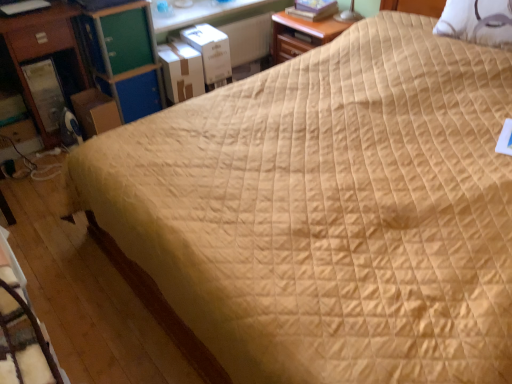
Question: Is white textured pillow at upper right located outside brown cardboard box at left, which is the first cardboard box in left-to-right order?

Choices:
 (A) no
 (B) yes

Answer: (B)

Question: From the image's perspective, does white textured pillow at upper right appear lower than brown cardboard box at left, which is the first cardboard box in left-to-right order?

Choices:
 (A) no
 (B) yes

Answer: (A)

Question: From a real-world perspective, is white textured pillow at upper right located beneath brown cardboard box at left, which ranks as the 3th cardboard box in right-to-left order?

Choices:
 (A) no
 (B) yes

Answer: (A)

Question: Is white textured pillow at upper right thinner than brown cardboard box at left, which ranks as the 3th cardboard box in right-to-left order?

Choices:
 (A) yes
 (B) no

Answer: (A)

Question: Can you confirm if white textured pillow at upper right is positioned to the right of brown cardboard box at left, which ranks as the 3th cardboard box in right-to-left order?

Choices:
 (A) no
 (B) yes

Answer: (B)

Question: From a real-world perspective, is matte wood nightstand at upper center, the 2th nightstand in the left-to-right sequence, above or below green wood drawer at upper left?

Choices:
 (A) below
 (B) above

Answer: (A)

Question: Based on their sizes in the image, would you say matte wood nightstand at upper center, acting as the 1th nightstand starting from the right, is bigger or smaller than green wood drawer at upper left?

Choices:
 (A) small
 (B) big

Answer: (B)

Question: Considering the positions of matte wood nightstand at upper center, the 2th nightstand in the left-to-right sequence, and green wood drawer at upper left in the image, is matte wood nightstand at upper center, the 2th nightstand in the left-to-right sequence, taller or shorter than green wood drawer at upper left?

Choices:
 (A) tall
 (B) short

Answer: (A)

Question: Is point (282, 13) closer or farther from the camera than point (114, 51)?

Choices:
 (A) farther
 (B) closer

Answer: (A)

Question: Is matte wood nightstand at upper center, acting as the 1th nightstand starting from the right, in front of or behind brown cardboard box at left, which ranks as the 3th cardboard box in right-to-left order, in the image?

Choices:
 (A) front
 (B) behind

Answer: (B)

Question: Considering the positions of point (305, 18) and point (99, 125), is point (305, 18) closer or farther from the camera than point (99, 125)?

Choices:
 (A) farther
 (B) closer

Answer: (A)

Question: Would you say matte wood nightstand at upper center, acting as the 1th nightstand starting from the right, is inside or outside brown cardboard box at left, which ranks as the 3th cardboard box in right-to-left order?

Choices:
 (A) outside
 (B) inside

Answer: (A)

Question: Is matte wood nightstand at upper center, acting as the 1th nightstand starting from the right, taller or shorter than brown cardboard box at left, which ranks as the 3th cardboard box in right-to-left order?

Choices:
 (A) short
 (B) tall

Answer: (B)

Question: Is velvet brown rocking chair at lower left inside or outside of green plastic file cabinet at upper left?

Choices:
 (A) inside
 (B) outside

Answer: (B)

Question: Considering their positions, is velvet brown rocking chair at lower left located in front of or behind green plastic file cabinet at upper left?

Choices:
 (A) front
 (B) behind

Answer: (A)